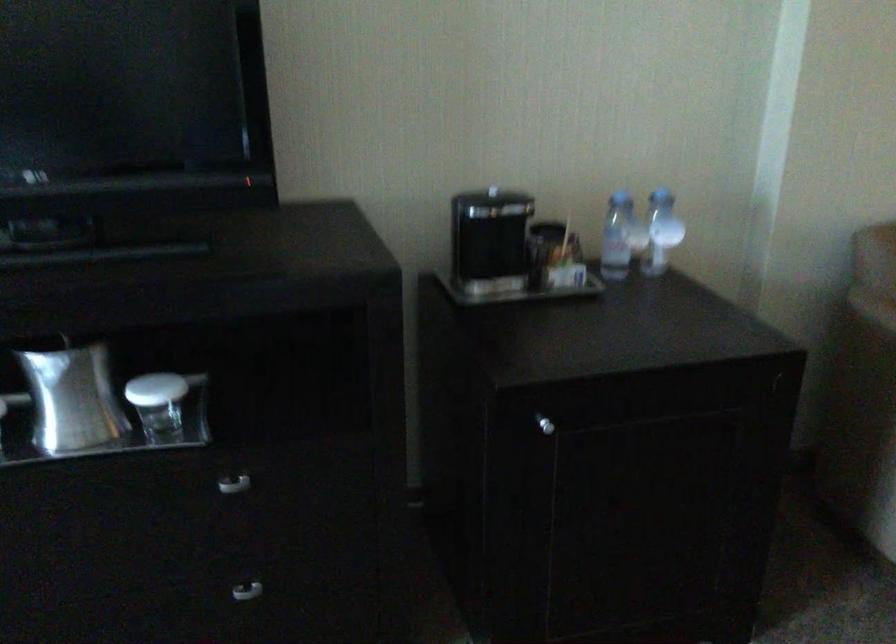
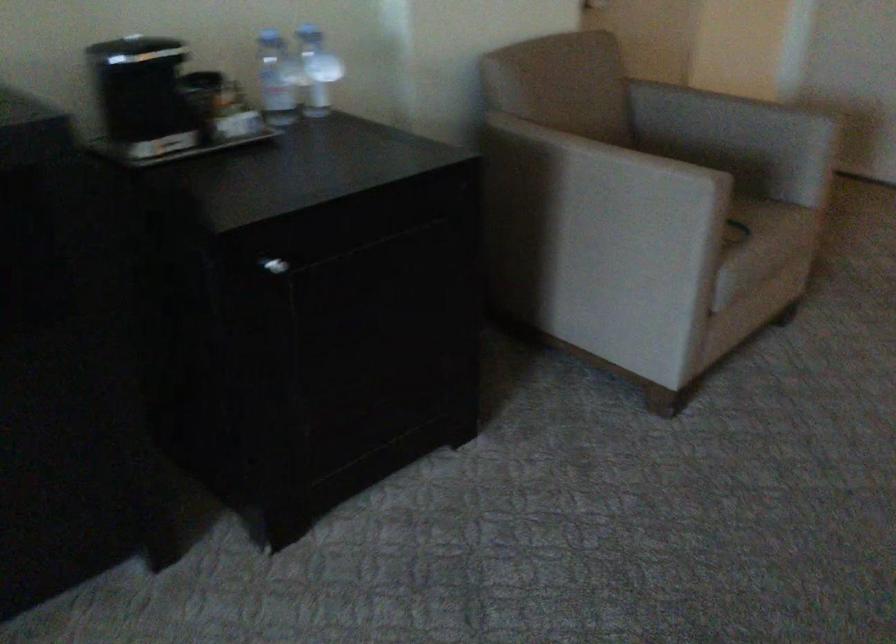
Question: The camera is either moving clockwise (left) or counter-clockwise (right) around the object. The first image is from the beginning of the video and the second image is from the end. Is the camera moving left or right when shooting the video?

Choices:
 (A) Left
 (B) Right

Answer: (A)